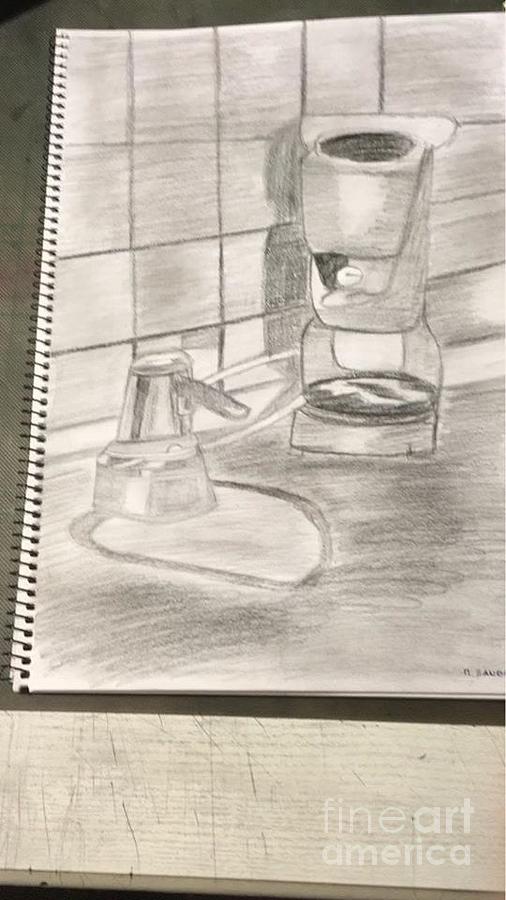
Locate an element on the screen. The image size is (506, 900). countertop is located at coordinates (165, 618), (404, 514).